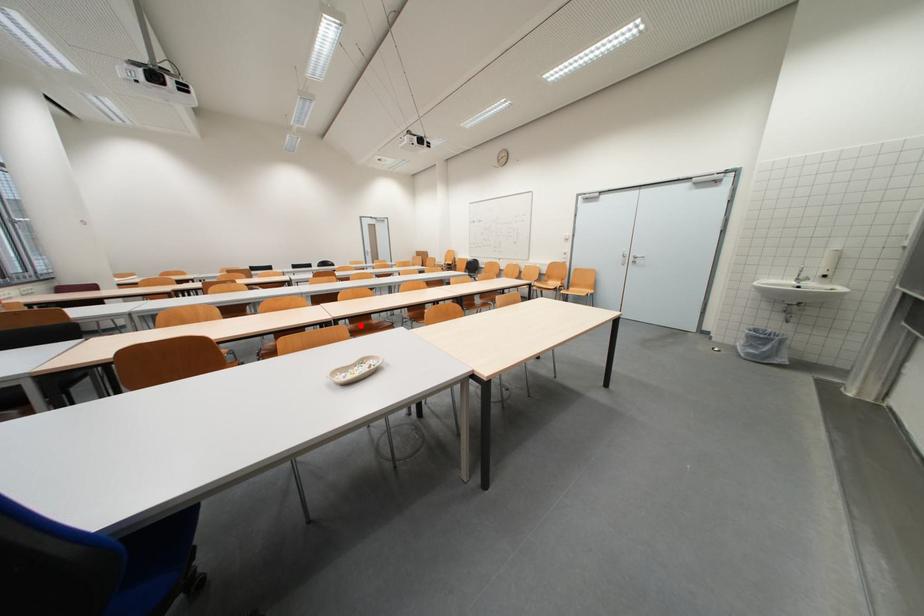
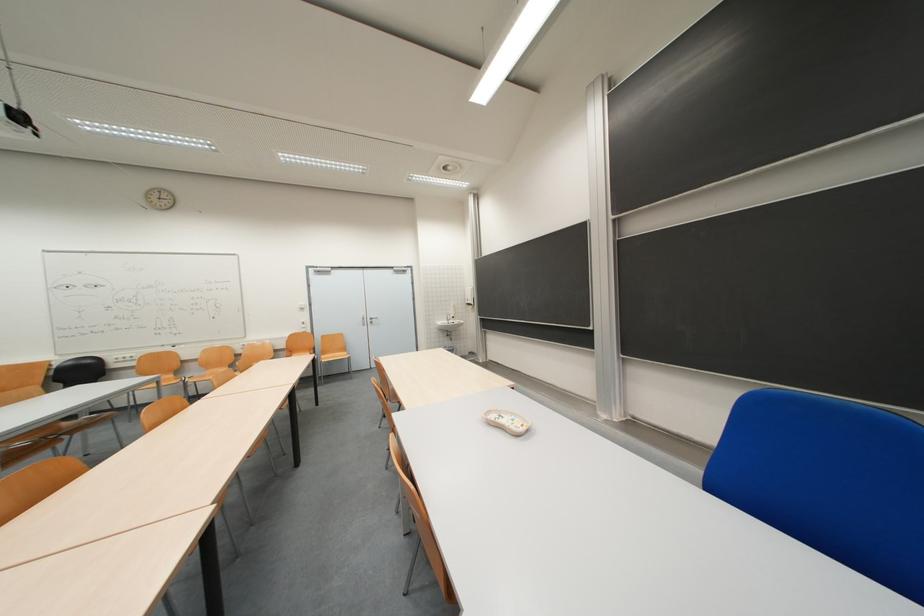
Question: I am providing you with two images of the same scene from different viewpoints. A red point is marked on the first image. Is the red point's position out of view in image 2?

Choices:
 (A) Yes
 (B) No

Answer: (A)